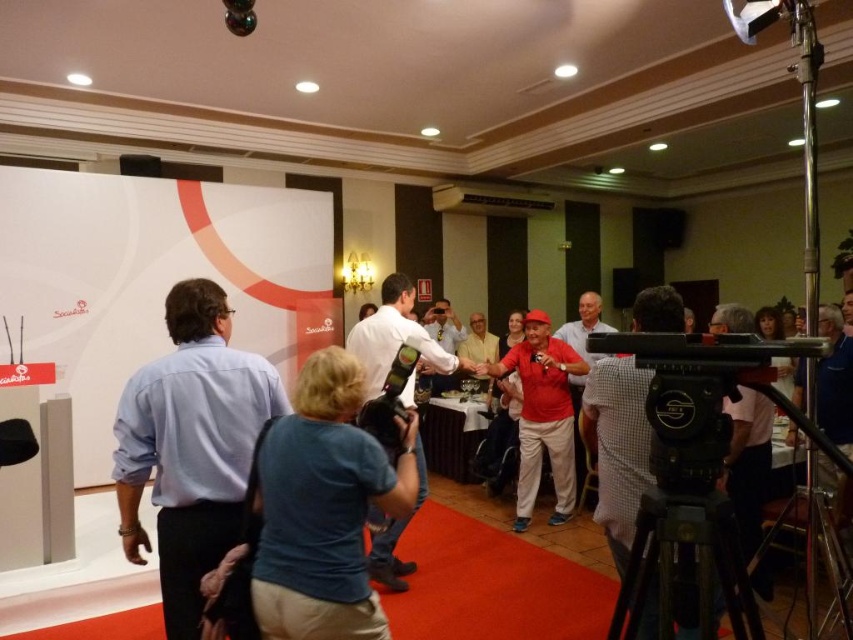
Question: Which object is farther from the camera taking this photo?

Choices:
 (A) matte red shirt at center
 (B) white matte projection screen at upper left

Answer: (B)

Question: Which of the following is the closest to the observer?

Choices:
 (A) (311, 608)
 (B) (202, 204)

Answer: (A)

Question: Does black matte tripod at lower right lie in front of matte red shirt at center?

Choices:
 (A) yes
 (B) no

Answer: (A)

Question: Which object is the closest to the blue cotton shirt at center?

Choices:
 (A) red matte shirt at center
 (B) matte red shirt at center
 (C) black matte tripod at lower right
 (D) light blue shirt at left

Answer: (D)

Question: Does blue cotton shirt at center have a lesser width compared to black matte tripod at lower right?

Choices:
 (A) no
 (B) yes

Answer: (A)

Question: Does light blue shirt at left have a larger size compared to blue cotton shirt at center?

Choices:
 (A) no
 (B) yes

Answer: (B)